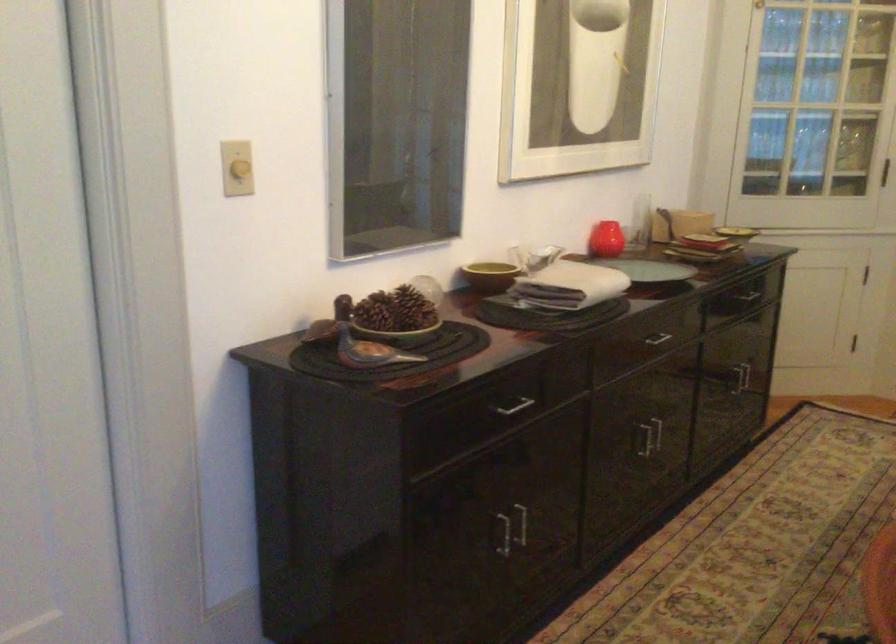
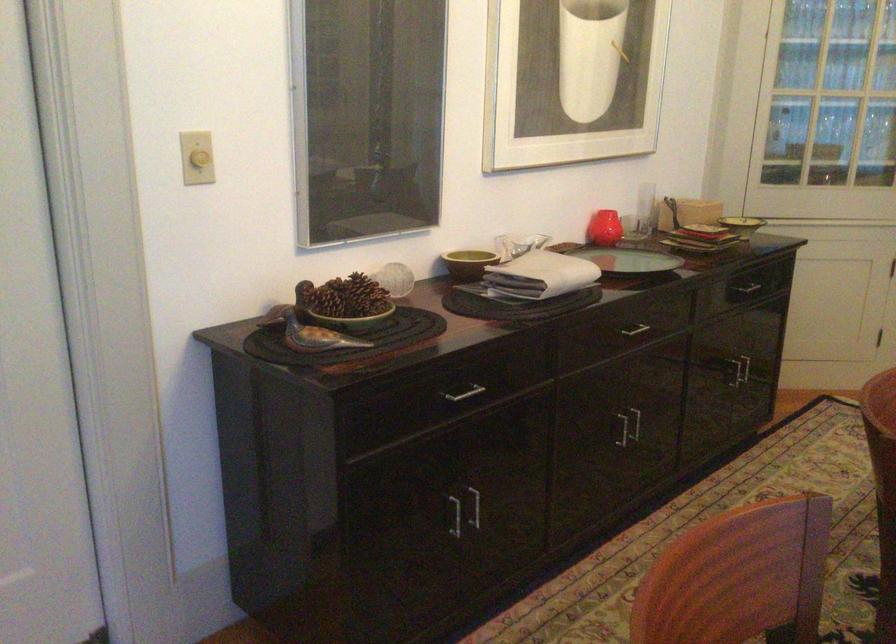
Locate, in the second image, the point that corresponds to (640,219) in the first image.

(645, 207)